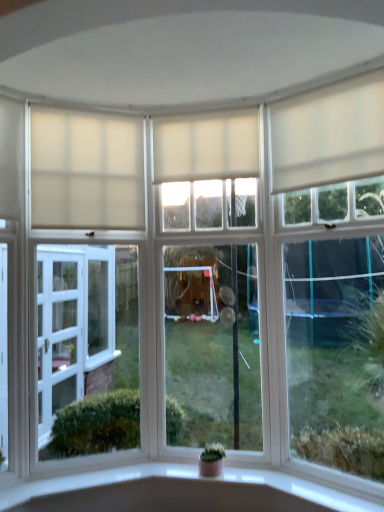
Identify the location of vacant space that is to the left of green matte houseplant at center. (182, 468).